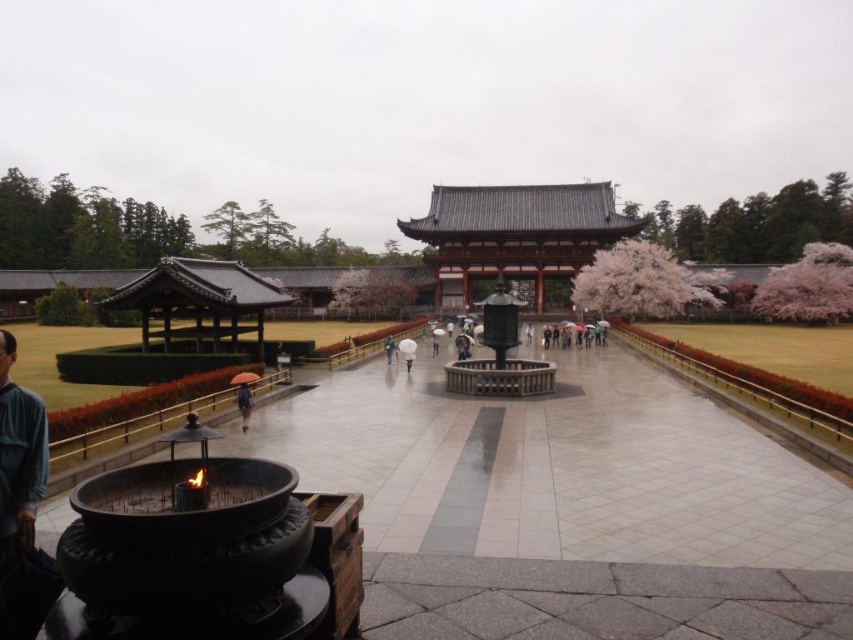
Question: Does matte gray wooden palace at center have a smaller size compared to orange fabric umbrella at center?

Choices:
 (A) yes
 (B) no

Answer: (B)

Question: Which object appears farthest from the camera in this image?

Choices:
 (A) blue fabric umbrella at lower left
 (B) matte gray wooden palace at center
 (C) orange fabric umbrella at center

Answer: (B)

Question: Which object is closer to the camera taking this photo?

Choices:
 (A) orange fabric umbrella at center
 (B) matte gray wooden palace at center
 (C) blue fabric umbrella at lower left

Answer: (C)

Question: Can you confirm if matte gray wooden palace at center is thinner than blue fabric umbrella at lower left?

Choices:
 (A) no
 (B) yes

Answer: (A)

Question: Does matte gray wooden palace at center have a lesser width compared to orange fabric umbrella at center?

Choices:
 (A) yes
 (B) no

Answer: (B)

Question: Which of the following is the closest to the observer?

Choices:
 (A) blue fabric umbrella at lower left
 (B) orange fabric umbrella at center
 (C) matte gray wooden palace at center

Answer: (A)